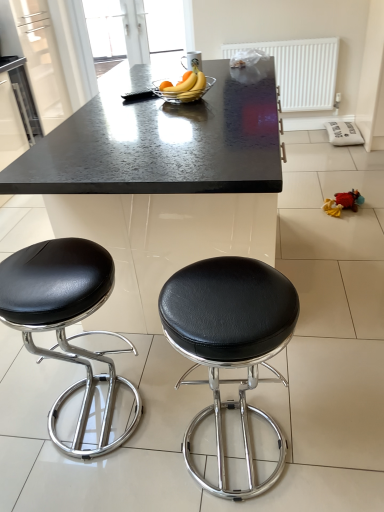
Question: From the image's perspective, is black leather stool at left, which is the first stool from left to right, over black leather stool at center, placed as the first stool when sorted from right to left?

Choices:
 (A) no
 (B) yes

Answer: (B)

Question: Is black leather stool at left, which is the first stool from left to right, at the left side of black leather stool at center, placed as the first stool when sorted from right to left?

Choices:
 (A) no
 (B) yes

Answer: (B)

Question: Is black leather stool at center, placed as the first stool when sorted from right to left, completely or partially inside black leather stool at left, which is the first stool from left to right?

Choices:
 (A) no
 (B) yes

Answer: (A)

Question: Is black leather stool at left, which is the first stool from left to right, shorter than black leather stool at center, the second stool when ordered from left to right?

Choices:
 (A) no
 (B) yes

Answer: (B)

Question: Does black leather stool at left, the 2th stool positioned from the right, appear on the right side of black leather stool at center, the second stool when ordered from left to right?

Choices:
 (A) yes
 (B) no

Answer: (B)

Question: Is black leather stool at left, which is the first stool from left to right, further to camera compared to black leather stool at center, the second stool when ordered from left to right?

Choices:
 (A) no
 (B) yes

Answer: (B)

Question: From a real-world perspective, is black leather stool at left, which is the first stool from left to right, physically above clear glass bowl at center?

Choices:
 (A) no
 (B) yes

Answer: (A)

Question: From the image's perspective, would you say black leather stool at left, the 2th stool positioned from the right, is shown under clear glass bowl at center?

Choices:
 (A) no
 (B) yes

Answer: (B)

Question: Does black leather stool at left, which is the first stool from left to right, have a greater height compared to clear glass bowl at center?

Choices:
 (A) yes
 (B) no

Answer: (A)

Question: Does black leather stool at left, which is the first stool from left to right, have a lesser height compared to clear glass bowl at center?

Choices:
 (A) no
 (B) yes

Answer: (A)

Question: Considering the relative sizes of black leather stool at left, the 2th stool positioned from the right, and clear glass bowl at center in the image provided, is black leather stool at left, the 2th stool positioned from the right, bigger than clear glass bowl at center?

Choices:
 (A) yes
 (B) no

Answer: (A)

Question: From a real-world perspective, is black leather stool at left, which is the first stool from left to right, under clear glass bowl at center?

Choices:
 (A) yes
 (B) no

Answer: (A)

Question: Can you confirm if black granite table at center is smaller than black leather stool at left, the 2th stool positioned from the right?

Choices:
 (A) no
 (B) yes

Answer: (A)